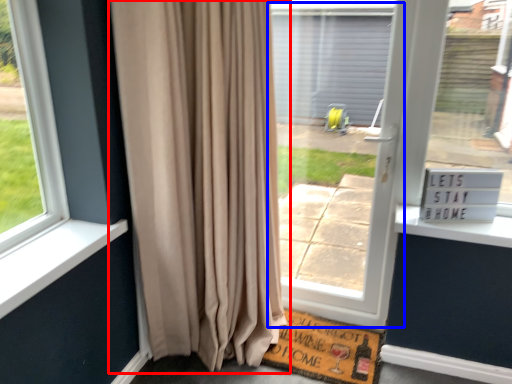
Question: Among these objects, which one is nearest to the camera, curtain (highlighted by a red box) or screen door (highlighted by a blue box)?

Choices:
 (A) curtain
 (B) screen door

Answer: (A)